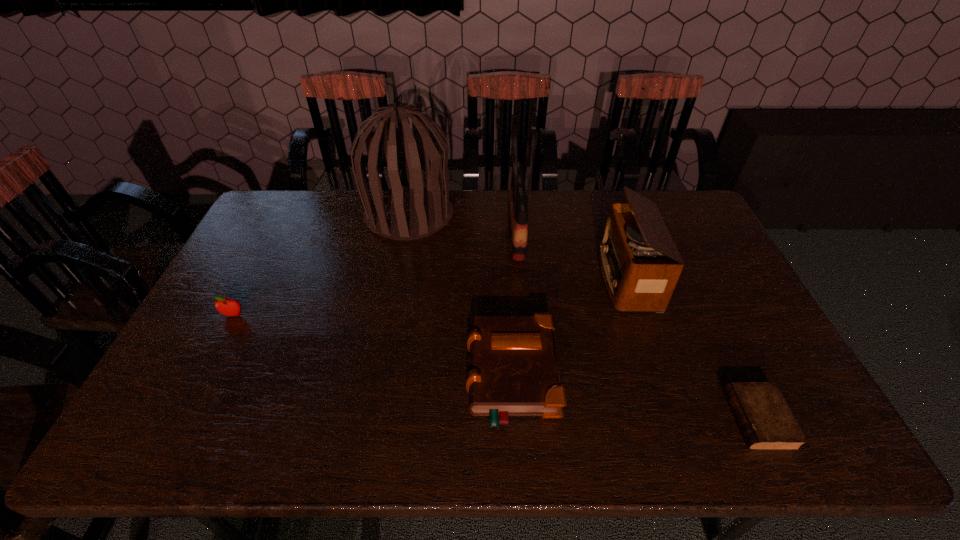
Find the location of a particular element. This screenshot has height=540, width=960. object that is the fourth closest to the shopping bag is located at coordinates (766, 422).

Identify which object is the fourth closest to the Bible. Please provide its 2D coordinates. Your answer should be formatted as a tuple, i.e. [(x, y)], where the tuple contains the x and y coordinates of a point satisfying the conditions above.

[(766, 422)]